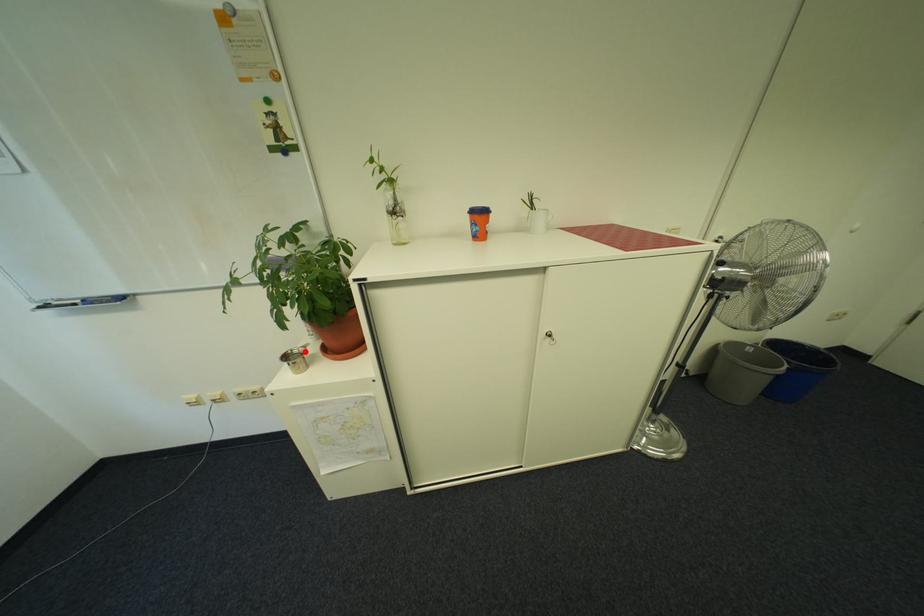
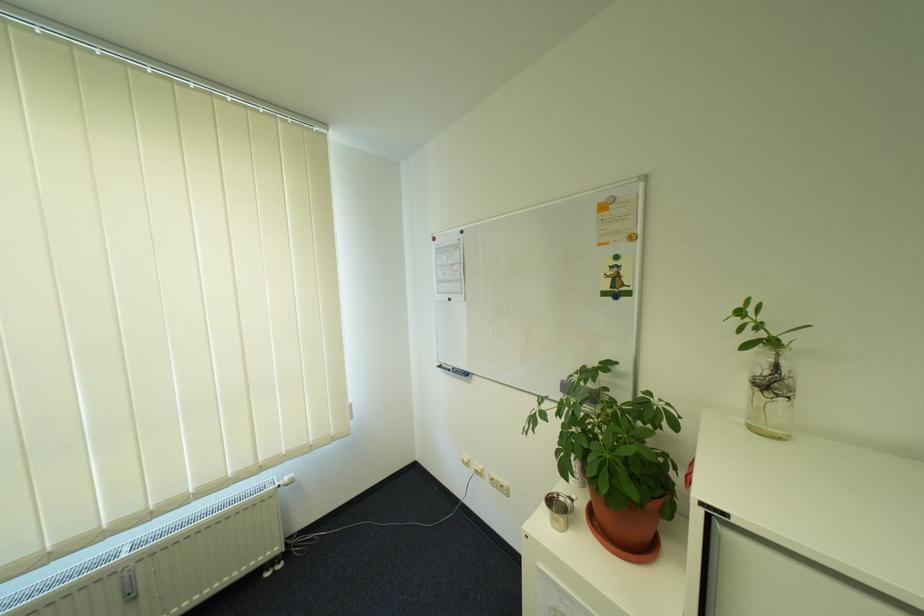
Question: I am providing you with two images of the same scene from different viewpoints. Image1 has a red point marked. In image2, the corresponding 3D location appears at what relative position? Reply with the corresponding letter.

Choices:
 (A) Closer
 (B) Farther

Answer: (B)